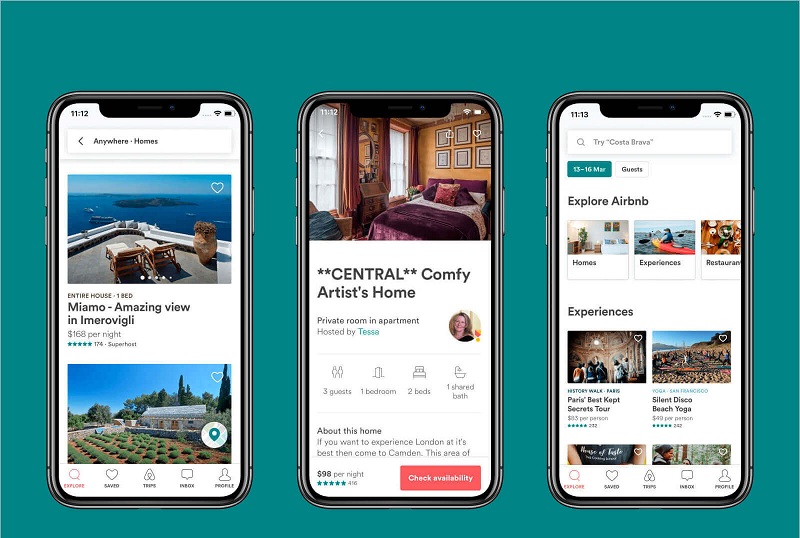
Where is `phones`? Image resolution: width=800 pixels, height=538 pixels. phones is located at coordinates (125, 377), (426, 399), (626, 395).